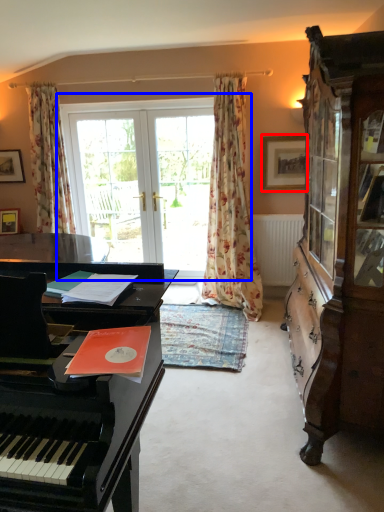
Question: Which point is further to the camera, picture frame (highlighted by a red box) or bay window (highlighted by a blue box)?

Choices:
 (A) picture frame
 (B) bay window

Answer: (B)